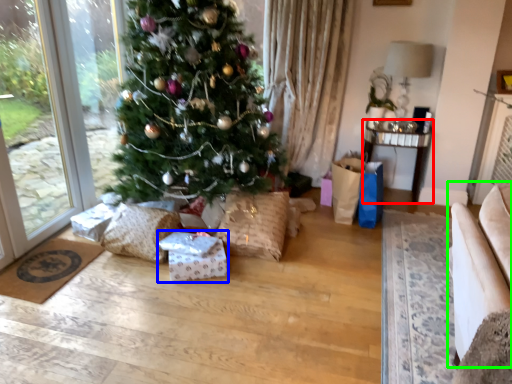
Question: Which is farther away from table (highlighted by a red box)? package (highlighted by a blue box) or armchair (highlighted by a green box)?

Choices:
 (A) package
 (B) armchair

Answer: (B)